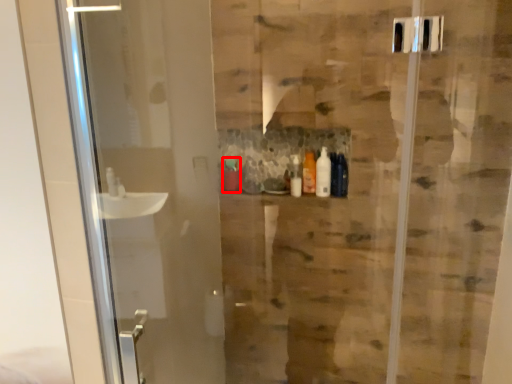
Question: From the image's perspective, where is toiletry (annotated by the red box) located in relation to toiletry in the image?

Choices:
 (A) above
 (B) below

Answer: (B)